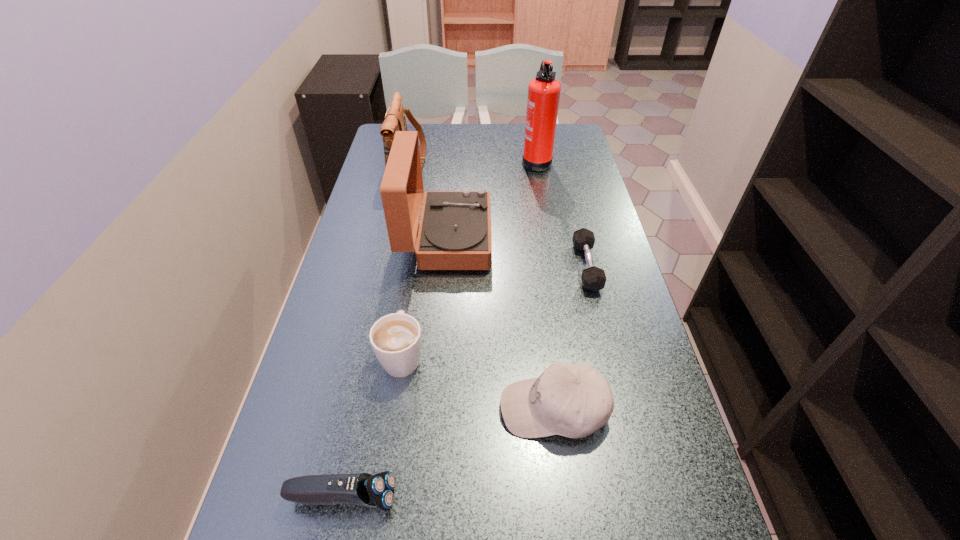
This screenshot has height=540, width=960. In order to click on dumbbell that is at the right edge in this screenshot , I will do `click(593, 278)`.

Find the location of `object at the far left corner`. object at the far left corner is located at coordinates (395, 120).

Identify the location of object positioned at the far right corner. (543, 91).

The width and height of the screenshot is (960, 540). In the image, there is a desktop. What are the coordinates of `vacant space at the far edge` in the screenshot? It's located at (478, 153).

Where is `blank space at the left edge`? This screenshot has height=540, width=960. blank space at the left edge is located at coordinates (329, 301).

The image size is (960, 540). Identify the location of free space at the right edge of the desktop. (635, 476).

In order to click on vacant space at the far right corner in this screenshot , I will do `click(564, 134)`.

Locate an element on the screen. The image size is (960, 540). vacant area between the second shortest object and the rightmost object is located at coordinates (465, 382).

Locate an element on the screen. unoccupied area between the cappuccino and the baseball cap is located at coordinates (478, 382).

Find the location of a particular element. The width and height of the screenshot is (960, 540). empty location between the shoulder bag and the tallest object is located at coordinates (472, 160).